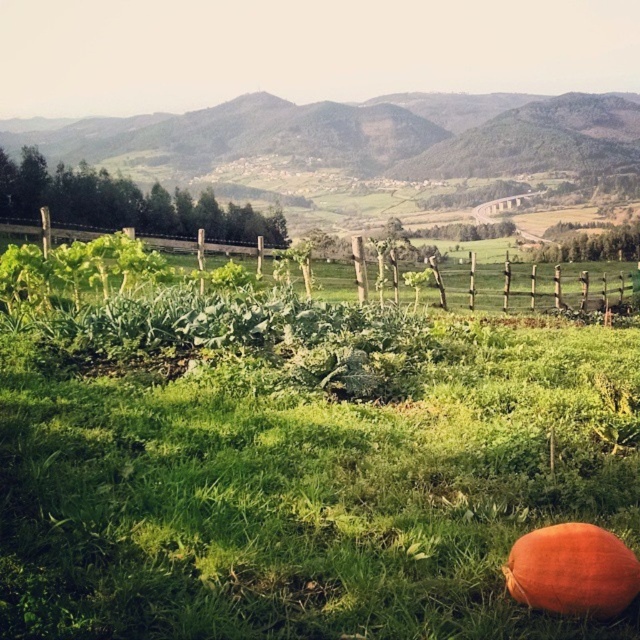
Looking at this image, you are a gardener who wants to plant a new row of carrots. You have two areas to choose from in the garden scene described. One is the green grassy at center and the other is the green grassy hillside at center. Which area would you choose if you want to plant more carrot rows because it has a wider space?

The green grassy hillside at center has a greater width than the green grassy at center, so you should choose the green grassy hillside at center to plant more carrot rows because it offers more space.